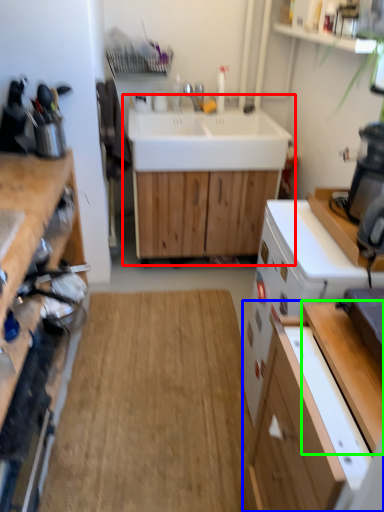
Question: Which object is the farthest from sink (highlighted by a red box)? Choose among these: cabinetry (highlighted by a blue box) or table (highlighted by a green box).

Choices:
 (A) cabinetry
 (B) table

Answer: (A)